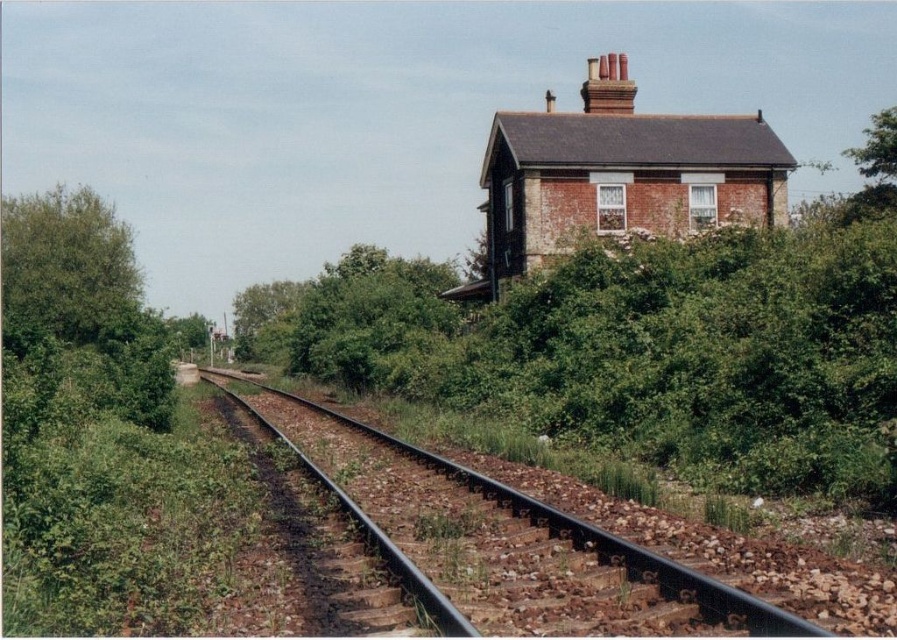
Does black metal train track at lower left have a lesser height compared to green leafy tree at center?

Yes, black metal train track at lower left is shorter than green leafy tree at center.

Looking at this image, is black metal train track at lower left positioned behind green leafy tree at center?

No, it is in front of green leafy tree at center.

The image size is (897, 640). Identify the location of black metal train track at lower left. (585, 532).

Can you confirm if green leafy tree at left is wider than red brick chimney at upper center?

Yes.

Is green leafy tree at left to the right of red brick chimney at upper center from the viewer's perspective?

Incorrect, green leafy tree at left is not on the right side of red brick chimney at upper center.

Between point (76, 317) and point (590, 76), which one is positioned behind?

The point (76, 317) is behind.

Find the location of a particular element. The height and width of the screenshot is (640, 897). green leafy tree at left is located at coordinates point(66,262).

Measure the distance from green leafy tree at center to red brick chimney at upper center.

They are 203.25 feet apart.

Is green leafy tree at center to the right of red brick chimney at upper center from the viewer's perspective?

In fact, green leafy tree at center is to the left of red brick chimney at upper center.

What do you see at coordinates (266, 317) in the screenshot? This screenshot has height=640, width=897. I see `green leafy tree at center` at bounding box center [266, 317].

Where is `green leafy tree at center`? Image resolution: width=897 pixels, height=640 pixels. green leafy tree at center is located at coordinates (266, 317).